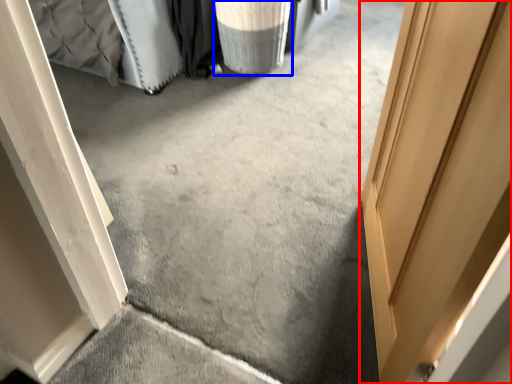
Question: Which object appears farthest to the camera in this image, door (highlighted by a red box) or laundry basket (highlighted by a blue box)?

Choices:
 (A) door
 (B) laundry basket

Answer: (B)